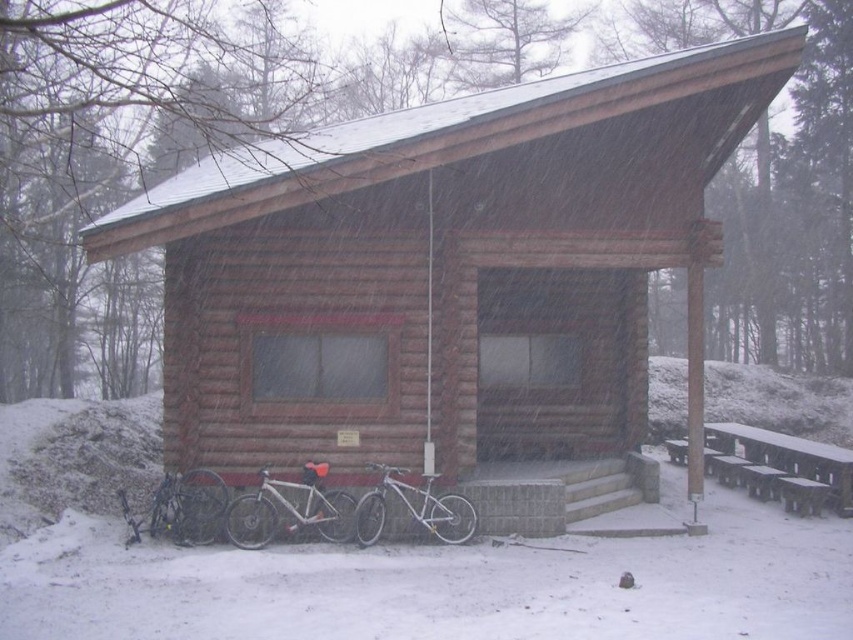
Question: Is silver metallic bicycle at lower left to the right of silver metallic bicycle at lower center from the viewer's perspective?

Choices:
 (A) no
 (B) yes

Answer: (A)

Question: Is wooden picnic table at lower right thinner than silver metallic bicycle at lower left?

Choices:
 (A) no
 (B) yes

Answer: (B)

Question: Which of the following is the closest to the observer?

Choices:
 (A) (236, 410)
 (B) (837, 472)

Answer: (A)

Question: Can you confirm if wooden picnic table at lower right is positioned above shiny metallic bicycle at lower left?

Choices:
 (A) yes
 (B) no

Answer: (A)

Question: Which point is closer to the camera?

Choices:
 (A) brown wooden cabin at center
 (B) shiny metallic bicycle at lower left
 (C) silver metallic bicycle at lower center

Answer: (A)

Question: Estimate the real-world distances between objects in this image. Which object is closer to the silver metallic bicycle at lower center?

Choices:
 (A) shiny metallic bicycle at lower left
 (B) wooden picnic table at lower right
 (C) silver metallic bicycle at lower left
 (D) brown wooden cabin at center

Answer: (C)